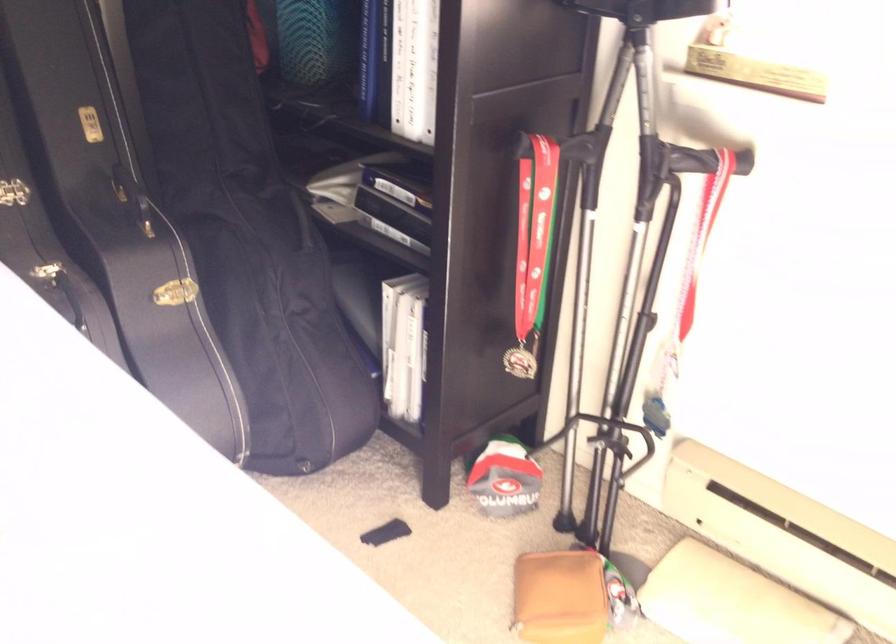
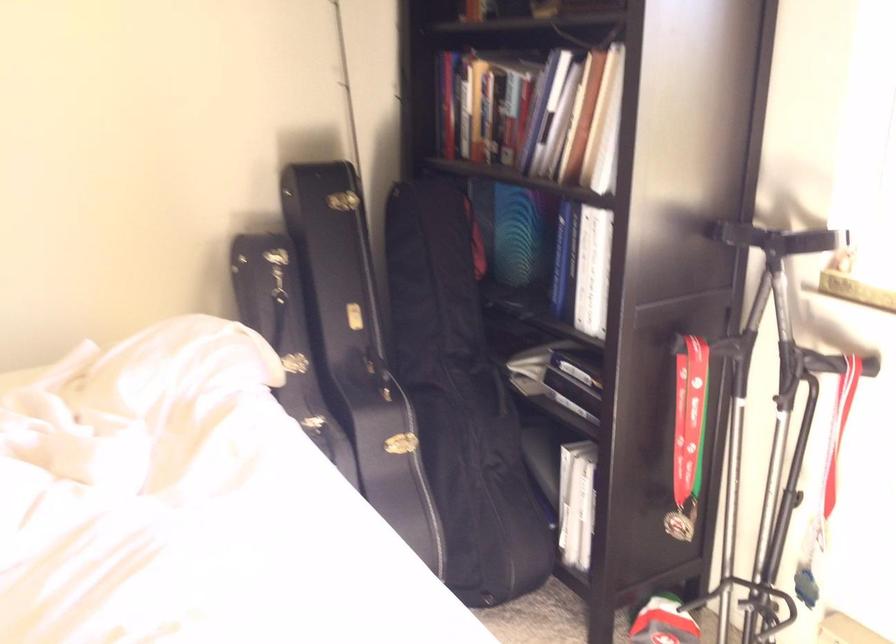
The point at (288,214) is marked in the first image. Where is the corresponding point in the second image?

(489, 386)